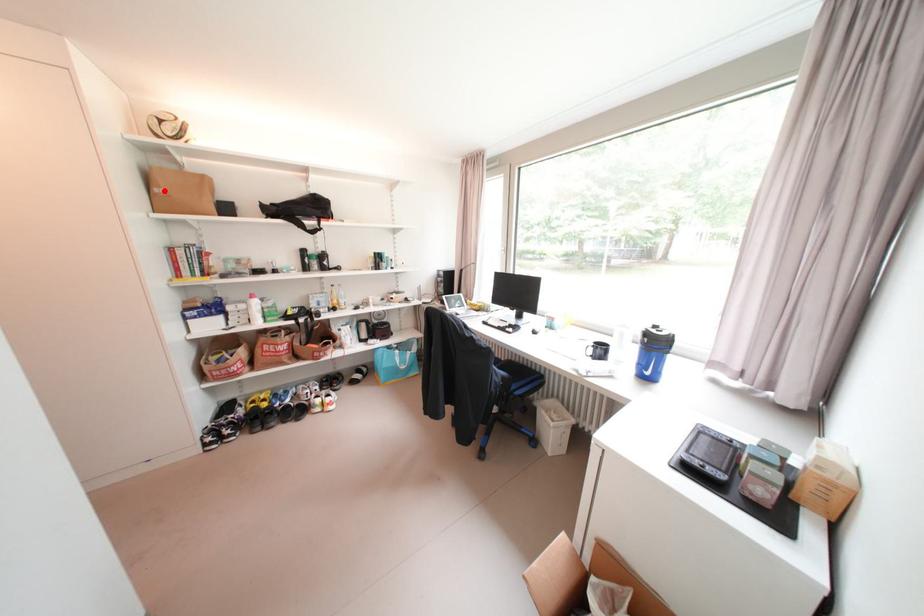
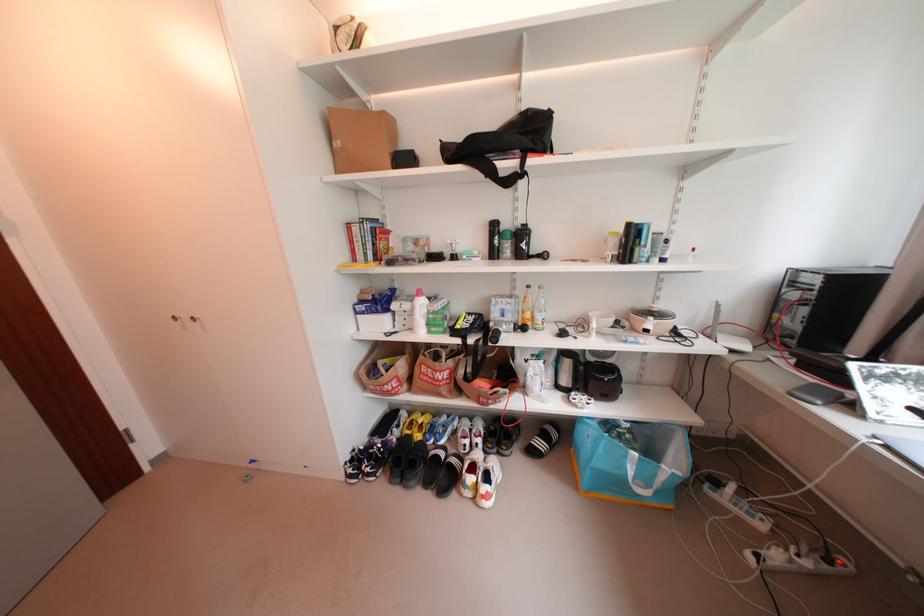
Locate, in the second image, the point that corresponds to the highlighted location in the first image.

(343, 145)